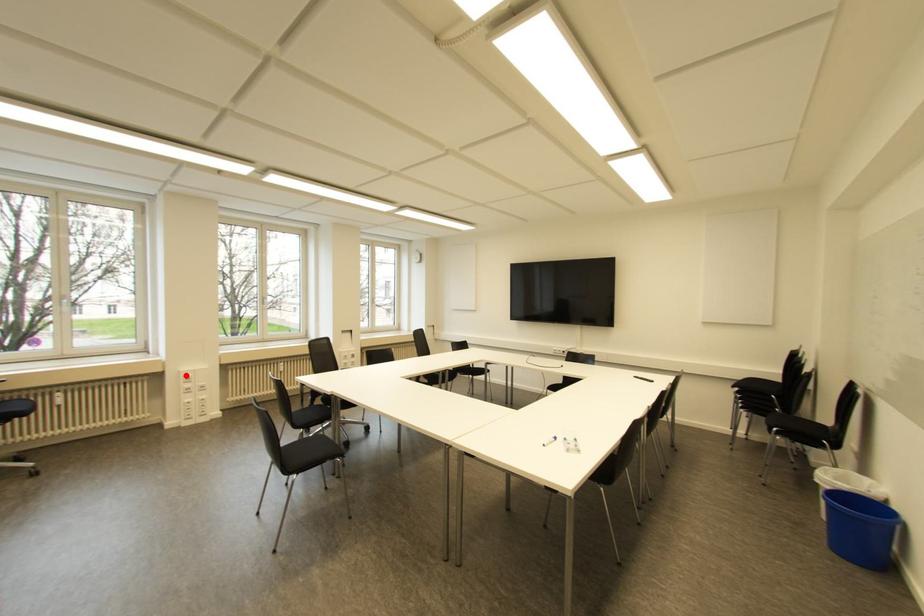
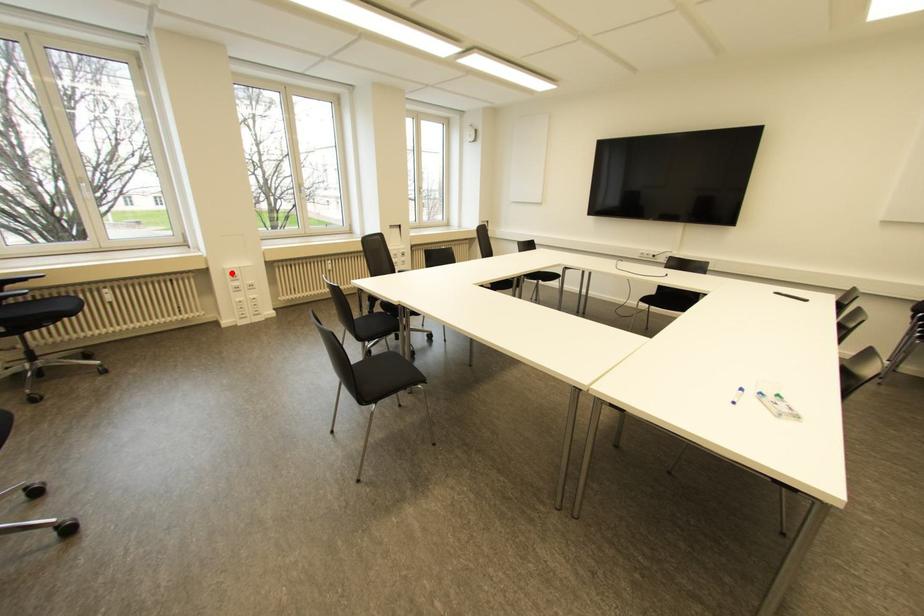
I am providing you with two images of the same scene from different viewpoints. A red point is marked on the first image and another point is marked on the second image. Do the highlighted points in image1 and image2 indicate the same real-world spot?

Yes